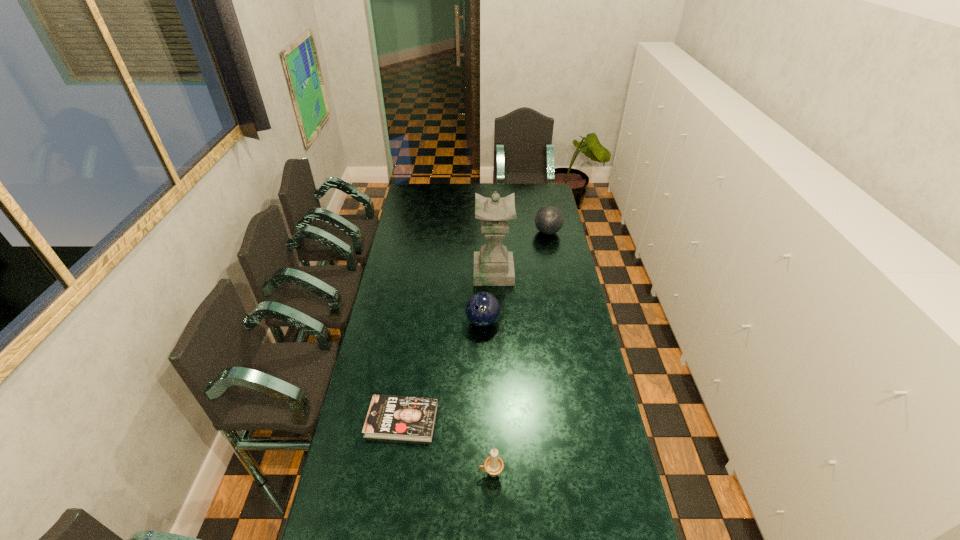
Locate an element on the screen. free space located 0.220m at the front opening of the second farthest object is located at coordinates (429, 272).

You are a GUI agent. You are given a task and a screenshot of the screen. Output one action in this format:
    pyautogui.click(x=<x>, y=<y>)
    Task: Click on the free region located at the front opening of the second farthest object
    Image resolution: width=960 pixels, height=540 pixels.
    Given the screenshot: What is the action you would take?
    (x=403, y=272)

This screenshot has width=960, height=540. I want to click on vacant space positioned 0.270m on the grip area of the farthest object, so click(485, 232).

You are a GUI agent. You are given a task and a screenshot of the screen. Output one action in this format:
    pyautogui.click(x=<x>, y=<y>)
    Task: Click on the vacant space located on the grip area of the farthest object
    The height and width of the screenshot is (540, 960).
    Given the screenshot: What is the action you would take?
    pyautogui.click(x=503, y=232)

This screenshot has height=540, width=960. Find the location of `free space located on the grip area of the farthest object`. free space located on the grip area of the farthest object is located at coordinates (512, 232).

Locate an element on the screen. This screenshot has height=540, width=960. free space located on the surface of the third farthest object near the finger holes is located at coordinates click(483, 369).

I want to click on blank space located 0.070m on the handle side of the candle_holder, so click(x=457, y=474).

At what (x,y) coordinates should I click in order to perform the action: click on vacant area situated on the handle side of the candle_holder. Please return your answer as a coordinate pair (x, y). The width and height of the screenshot is (960, 540). Looking at the image, I should click on (414, 474).

The height and width of the screenshot is (540, 960). Find the location of `free spot located on the handle side of the candle_holder`. free spot located on the handle side of the candle_holder is located at coordinates (429, 474).

Find the location of a particular element. vacant space situated on the left of the leftmost object is located at coordinates (353, 420).